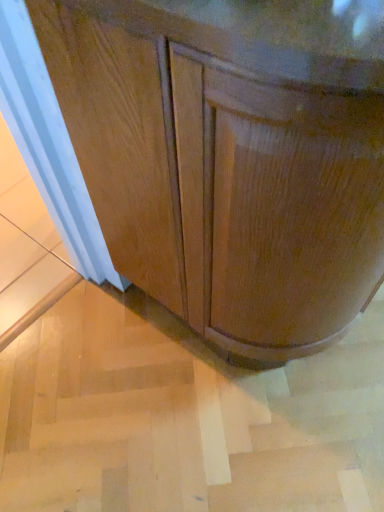
Question: Is glossy wood cabinet at center not close to light brown wood stair at lower left?

Choices:
 (A) yes
 (B) no

Answer: (B)

Question: Is glossy wood cabinet at center thinner than light brown wood stair at lower left?

Choices:
 (A) no
 (B) yes

Answer: (B)

Question: Can you confirm if glossy wood cabinet at center is positioned to the left of light brown wood stair at lower left?

Choices:
 (A) no
 (B) yes

Answer: (A)

Question: Is glossy wood cabinet at center completely or partially outside of light brown wood stair at lower left?

Choices:
 (A) yes
 (B) no

Answer: (A)

Question: From a real-world perspective, is glossy wood cabinet at center on top of light brown wood stair at lower left?

Choices:
 (A) yes
 (B) no

Answer: (A)

Question: Is light brown wood stair at lower left inside glossy wood cabinet at center?

Choices:
 (A) no
 (B) yes

Answer: (A)

Question: Does light brown wood stair at lower left appear on the left side of glossy wood cabinet at center?

Choices:
 (A) yes
 (B) no

Answer: (A)

Question: Is light brown wood stair at lower left aimed at glossy wood cabinet at center?

Choices:
 (A) yes
 (B) no

Answer: (B)

Question: Can you confirm if light brown wood stair at lower left is positioned to the right of glossy wood cabinet at center?

Choices:
 (A) yes
 (B) no

Answer: (B)

Question: Considering the relative sizes of light brown wood stair at lower left and glossy wood cabinet at center in the image provided, is light brown wood stair at lower left smaller than glossy wood cabinet at center?

Choices:
 (A) no
 (B) yes

Answer: (B)

Question: Is glossy wood cabinet at center inside light brown wood stair at lower left?

Choices:
 (A) no
 (B) yes

Answer: (A)

Question: Does light brown wood stair at lower left lie behind glossy wood cabinet at center?

Choices:
 (A) no
 (B) yes

Answer: (B)

Question: Based on their positions, is glossy wood cabinet at center located to the left or right of light brown wood stair at lower left?

Choices:
 (A) left
 (B) right

Answer: (B)